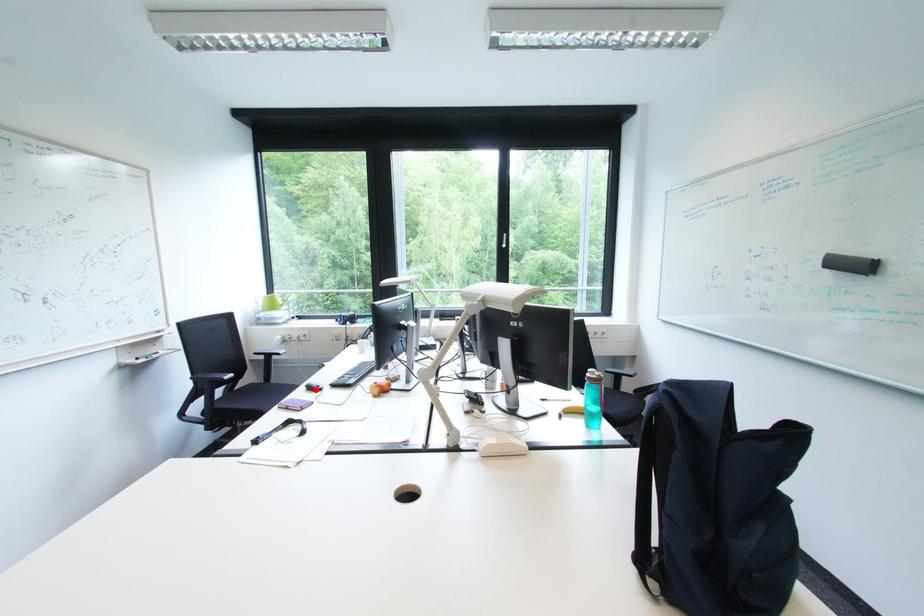
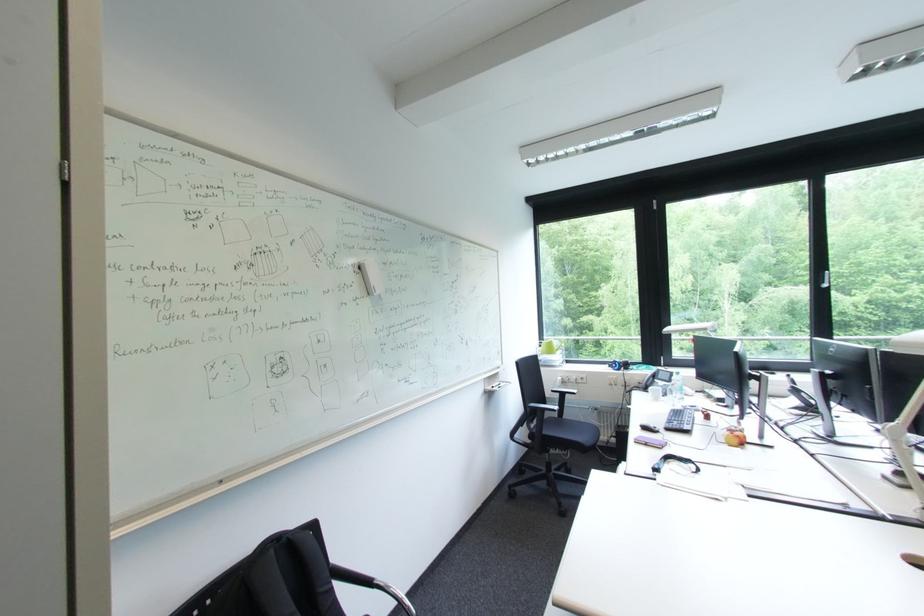
In the second image, find the point that corresponds to the highlighted location in the first image.

(650, 430)